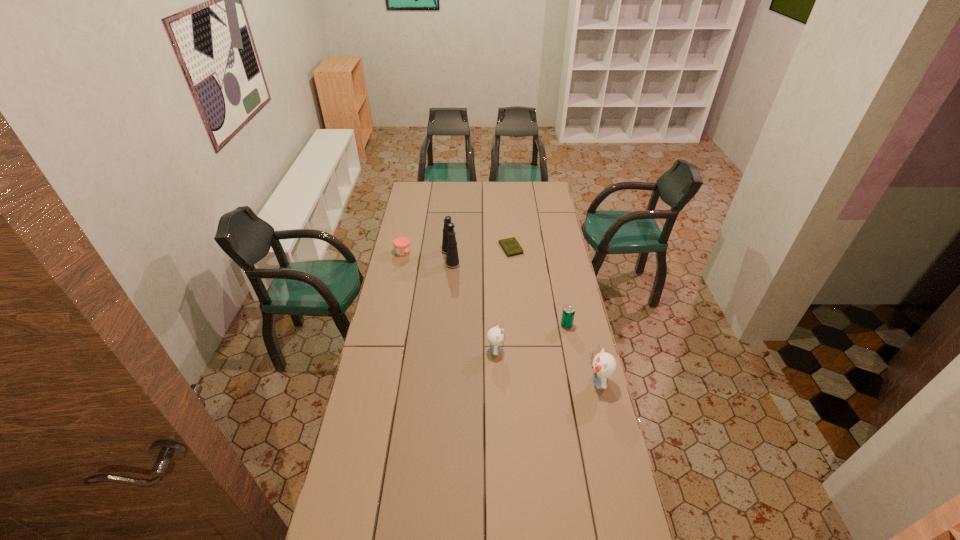
Where is `vacant region that satisfies the following two spatial constraints: 1. on the front side of the second object from right to left; 2. on the right side of the shortest object`? vacant region that satisfies the following two spatial constraints: 1. on the front side of the second object from right to left; 2. on the right side of the shortest object is located at coordinates (517, 326).

At what (x,y) coordinates should I click in order to perform the action: click on free space that satisfies the following two spatial constraints: 1. on the front side of the binoculars; 2. on the right side of the second object from right to left. Please return your answer as a coordinate pair (x, y). Looking at the image, I should click on coord(445,326).

Find the location of a particular element. Image resolution: width=960 pixels, height=540 pixels. vacant space that satisfies the following two spatial constraints: 1. on the front label of the fifth tallest object; 2. on the back side of the binoculars is located at coordinates (402, 258).

I want to click on blank area in the image that satisfies the following two spatial constraints: 1. on the front label of the leftmost object; 2. on the left side of the second object from left to right, so click(402, 258).

Find the location of a particular element. The width and height of the screenshot is (960, 540). free point that satisfies the following two spatial constraints: 1. on the front label of the fifth tallest object; 2. on the left side of the beer can is located at coordinates (388, 326).

Locate an element on the screen. The width and height of the screenshot is (960, 540). vacant area in the image that satisfies the following two spatial constraints: 1. on the front side of the diary; 2. on the front-facing side of the second nearest object is located at coordinates (520, 351).